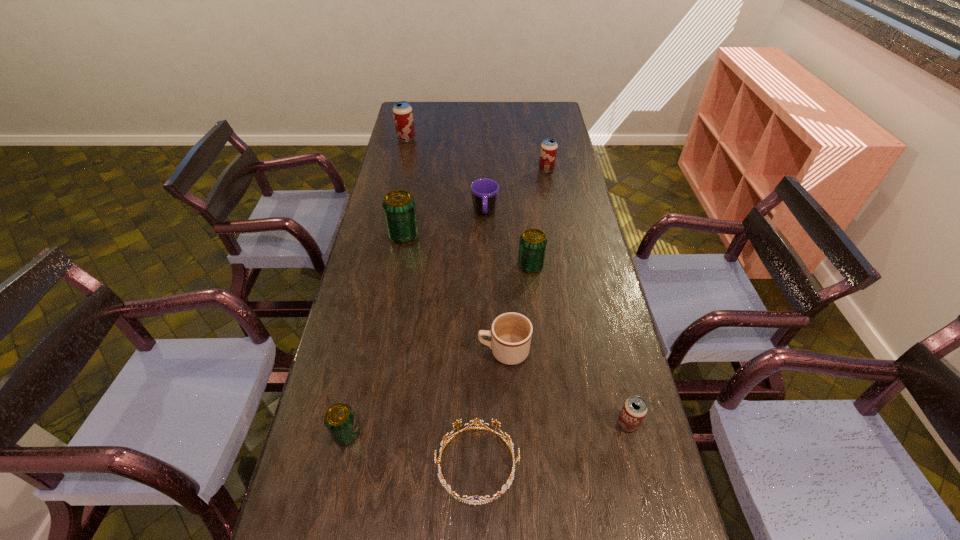
Select which object appears as the second closest to the third beer can from right to left. Please provide its 2D coordinates. Your answer should be formatted as a tuple, i.e. [(x, y)], where the tuple contains the x and y coordinates of a point satisfying the conditions above.

[(511, 333)]

Locate which object ranks fourth in proximity to the farthest object. Please provide its 2D coordinates. Your answer should be formatted as a tuple, i.e. [(x, y)], where the tuple contains the x and y coordinates of a point satisfying the conditions above.

[(533, 242)]

The height and width of the screenshot is (540, 960). What are the coordinates of `beer can that is the fourth nearest to the fifth nearest beer can` in the screenshot? It's located at (634, 410).

The image size is (960, 540). I want to click on the fifth closest beer can relative to the nearest green beer can, so click(403, 116).

Find the location of a particular element. green beer can that is the third closest one to the farthest object is located at coordinates (339, 419).

Identify the location of green beer can that is the second closest one to the sixth farthest object. This screenshot has width=960, height=540. (339, 419).

Locate which red beer can ranks third in proximity to the second smallest green beer can. Please provide its 2D coordinates. Your answer should be formatted as a tuple, i.e. [(x, y)], where the tuple contains the x and y coordinates of a point satisfying the conditions above.

[(403, 116)]

Identify which red beer can is the second closest to the nearest red beer can. Please provide its 2D coordinates. Your answer should be formatted as a tuple, i.e. [(x, y)], where the tuple contains the x and y coordinates of a point satisfying the conditions above.

[(403, 116)]

Identify the location of vacant region that satisfies the following two spatial constraints: 1. with the handle on the side of the farther mug; 2. on the side of the brown mug with the handle. This screenshot has height=540, width=960. (487, 352).

The image size is (960, 540). What are the coordinates of `free space that satisfies the following two spatial constraints: 1. on the side of the nearer mug with the handle; 2. with the handle on the side of the farther mug` in the screenshot? It's located at (497, 213).